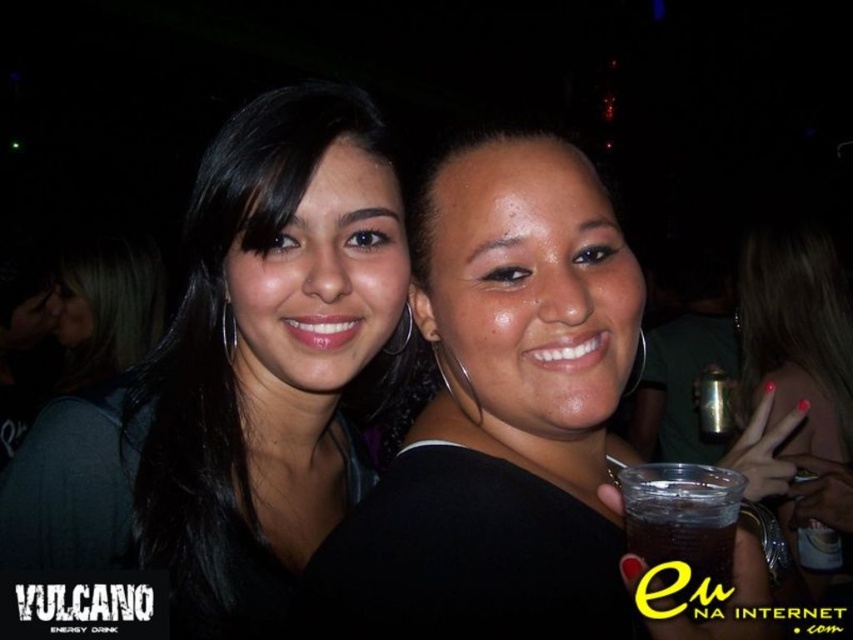
Is point (601, 515) in front of point (712, 566)?

That is False.

Describe the element at coordinates (502, 416) in the screenshot. This screenshot has height=640, width=853. I see `matte black shirt at center` at that location.

Identify the location of matte black shirt at center. This screenshot has height=640, width=853. (502, 416).

Between black hair at center and translucent plastic cup at lower right, which one has more height?

With more height is black hair at center.

From the picture: Does black hair at center have a greater height compared to translucent plastic cup at lower right?

Yes.

Is point (393, 172) farther from camera compared to point (675, 593)?

Yes, it is behind point (675, 593).

The height and width of the screenshot is (640, 853). Find the location of `black hair at center`. black hair at center is located at coordinates (236, 378).

Is point (55, 547) farther from camera compared to point (440, 198)?

Yes.

Which is in front, point (360, 323) or point (531, 497)?

Point (531, 497)

What do you see at coordinates (236, 378) in the screenshot?
I see `black hair at center` at bounding box center [236, 378].

Find the location of a particular element. black hair at center is located at coordinates (236, 378).